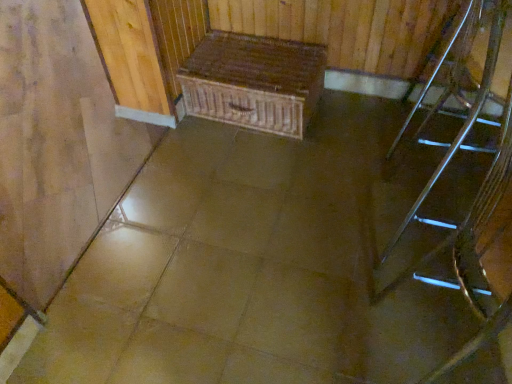
Question: From their relative heights in the image, would you say metallic silver chair at right is taller or shorter than wooden chest at center?

Choices:
 (A) tall
 (B) short

Answer: (A)

Question: Considering the positions of metallic silver chair at right and wooden chest at center in the image, is metallic silver chair at right bigger or smaller than wooden chest at center?

Choices:
 (A) small
 (B) big

Answer: (B)

Question: Which object is positioned closest to the metallic silver stairs at right?

Choices:
 (A) wooden chest at center
 (B) metallic silver chair at right

Answer: (B)

Question: Based on their relative distances, which object is nearer to the metallic silver stairs at right?

Choices:
 (A) metallic silver chair at right
 (B) wooden chest at center

Answer: (A)